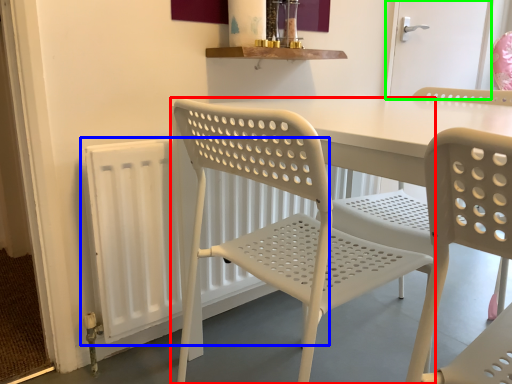
Question: Considering the real-world distances, which object is closest to chair (highlighted by a red box)? radiator (highlighted by a blue box) or screen door (highlighted by a green box).

Choices:
 (A) radiator
 (B) screen door

Answer: (A)